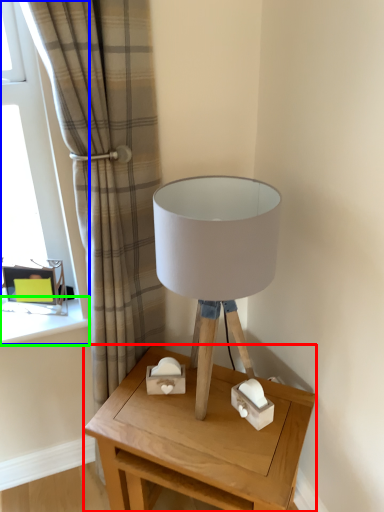
Question: Which object is positioned closest to table (highlighted by a red box)? Select from window (highlighted by a blue box) and window sill (highlighted by a green box).

Choices:
 (A) window
 (B) window sill

Answer: (B)